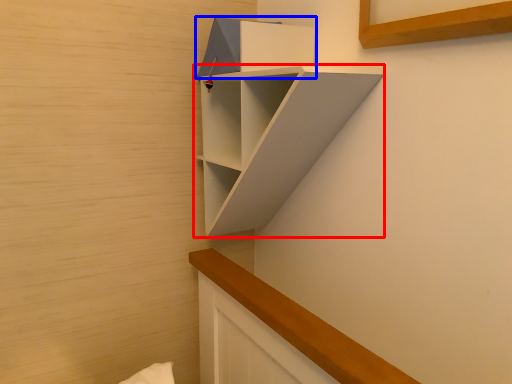
Question: Which object appears farthest to the camera in this image, shelf (highlighted by a red box) or cabinet (highlighted by a blue box)?

Choices:
 (A) shelf
 (B) cabinet

Answer: (B)